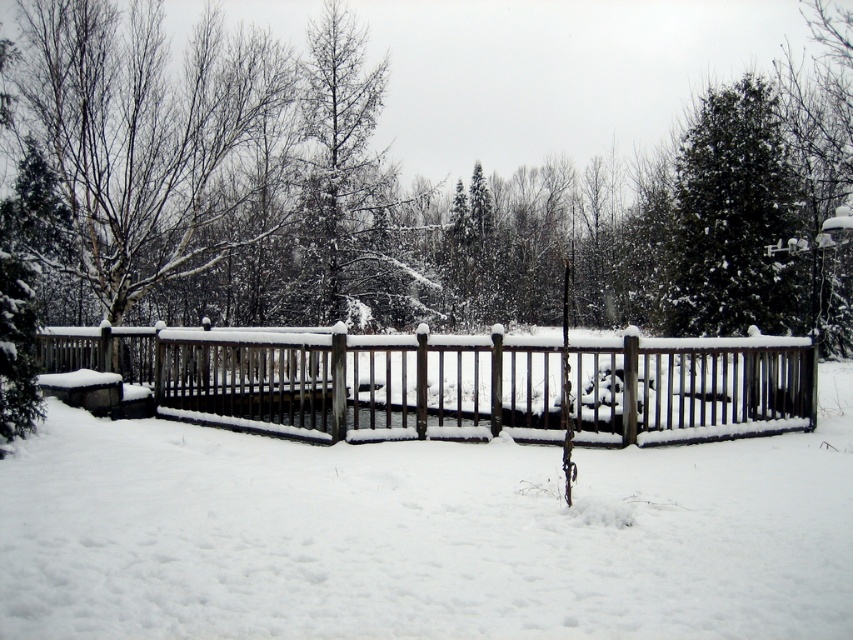
Question: Which of the following is the closest to the observer?

Choices:
 (A) green matte evergreen tree at upper right
 (B) wooden fence at center
 (C) white wooden fence at center

Answer: (B)

Question: Estimate the real-world distances between objects in this image. Which object is closer to the white wooden fence at center?

Choices:
 (A) green matte evergreen tree at upper right
 (B) wooden fence at center

Answer: (B)

Question: Is white wooden fence at center further to camera compared to wooden fence at center?

Choices:
 (A) no
 (B) yes

Answer: (B)

Question: Is white wooden fence at center positioned at the back of wooden fence at center?

Choices:
 (A) yes
 (B) no

Answer: (A)

Question: Which of the following is the closest to the observer?

Choices:
 (A) white wooden fence at center
 (B) green matte evergreen tree at upper right

Answer: (A)

Question: In this image, where is wooden fence at center located relative to green matte evergreen tree at upper right?

Choices:
 (A) above
 (B) below

Answer: (B)